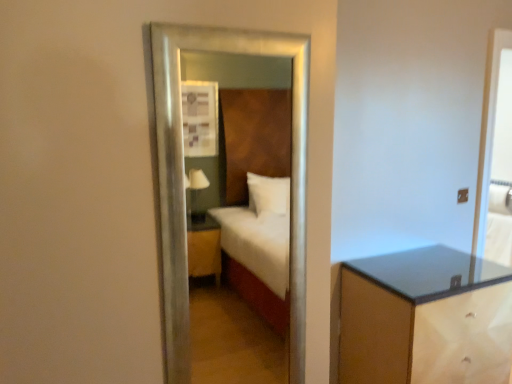
Question: Does point (298, 61) appear closer or farther from the camera than point (351, 367)?

Choices:
 (A) farther
 (B) closer

Answer: (B)

Question: Is silver metallic mirror at center taller or shorter than matte brown nightstand at lower right?

Choices:
 (A) tall
 (B) short

Answer: (A)

Question: Considering the real-world distances, which object is closest to the matte brown nightstand at lower right?

Choices:
 (A) clear glass screen door at right
 (B) silver metallic mirror at center

Answer: (A)

Question: Which object is positioned farthest from the matte brown nightstand at lower right?

Choices:
 (A) silver metallic mirror at center
 (B) clear glass screen door at right

Answer: (A)